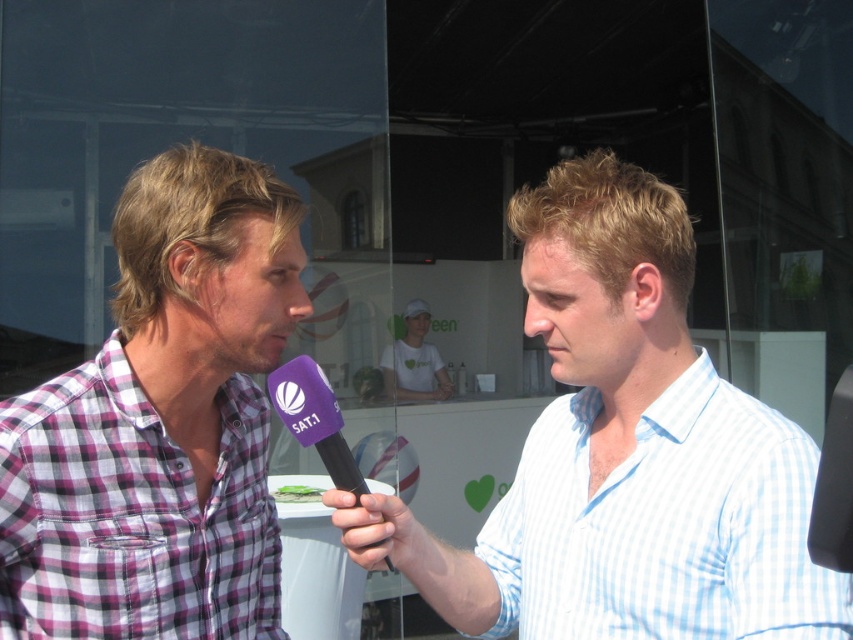
Question: Can you confirm if light blue striped shirt at center is positioned to the right of purple matte microphone at center?

Choices:
 (A) yes
 (B) no

Answer: (A)

Question: Which point is closer to the camera?

Choices:
 (A) light blue striped shirt at right
 (B) purple checkered shirt at left
 (C) white cotton t-shirt at center

Answer: (A)

Question: Estimate the real-world distances between objects in this image. Which object is closer to the light blue striped shirt at right?

Choices:
 (A) light blue striped shirt at center
 (B) purple checkered shirt at left
 (C) purple matte microphone at center

Answer: (A)

Question: From the image, what is the correct spatial relationship of purple matte microphone at center in relation to white cotton t-shirt at center?

Choices:
 (A) below
 (B) above

Answer: (B)

Question: Is purple checkered shirt at left positioned before purple matte microphone at center?

Choices:
 (A) no
 (B) yes

Answer: (A)

Question: Which of the following is the farthest from the observer?

Choices:
 (A) light blue striped shirt at right
 (B) light blue striped shirt at center

Answer: (B)